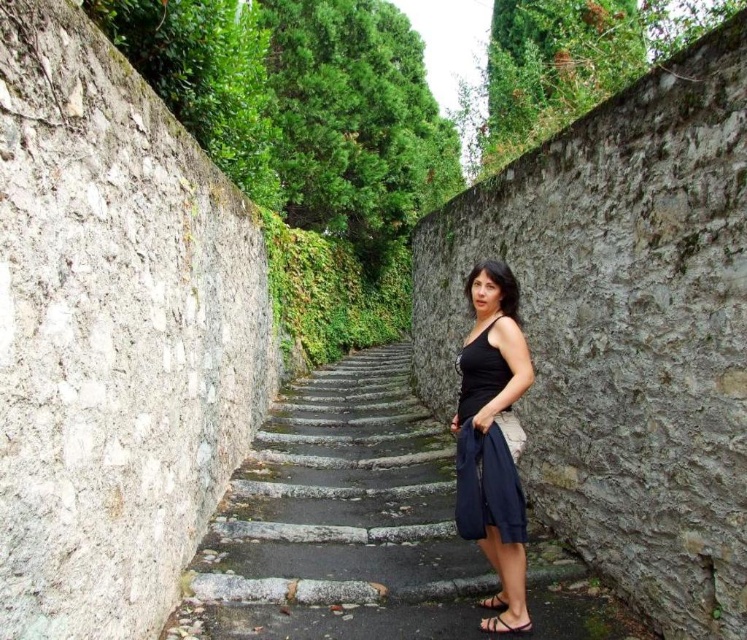
Question: Can you confirm if black satin dress at center is thinner than black leather sandal at lower center?

Choices:
 (A) yes
 (B) no

Answer: (B)

Question: Can you confirm if black satin dress at center is smaller than brown leather sandal at lower center?

Choices:
 (A) no
 (B) yes

Answer: (A)

Question: Which is nearer to the black matte dress at center?

Choices:
 (A) black leather sandal at lower center
 (B) brown leather sandal at lower center
 (C) black satin dress at center

Answer: (C)

Question: Is black satin dress at center closer to camera compared to brown leather sandal at lower center?

Choices:
 (A) yes
 (B) no

Answer: (A)

Question: Which point is farther from the camera taking this photo?

Choices:
 (A) (489, 620)
 (B) (502, 486)
 (C) (498, 609)
 (D) (514, 508)

Answer: (C)

Question: Which object appears closest to the camera in this image?

Choices:
 (A) black leather sandal at lower center
 (B) brown leather sandal at lower center
 (C) black matte dress at center

Answer: (C)